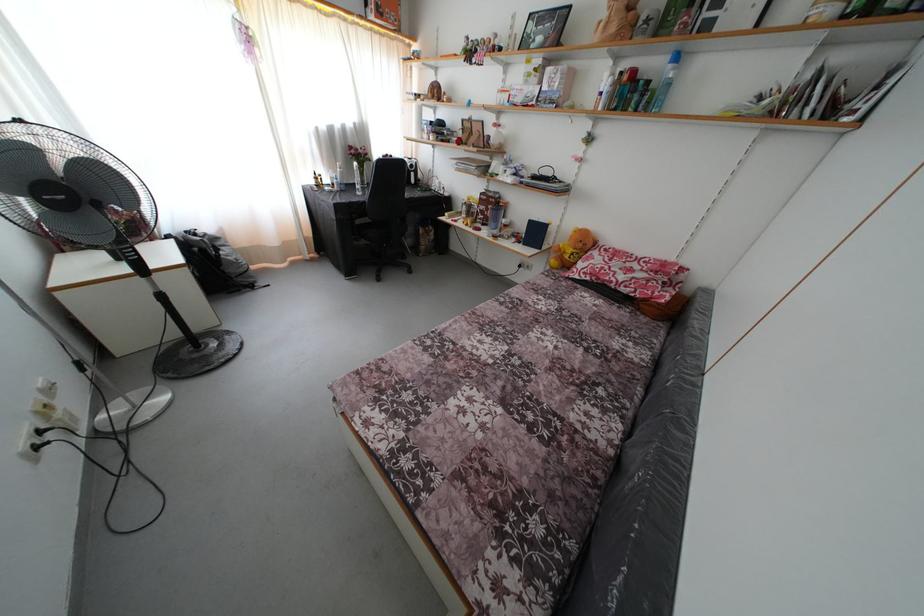
What do you see at coordinates (371, 231) in the screenshot?
I see `the chair sitting surface` at bounding box center [371, 231].